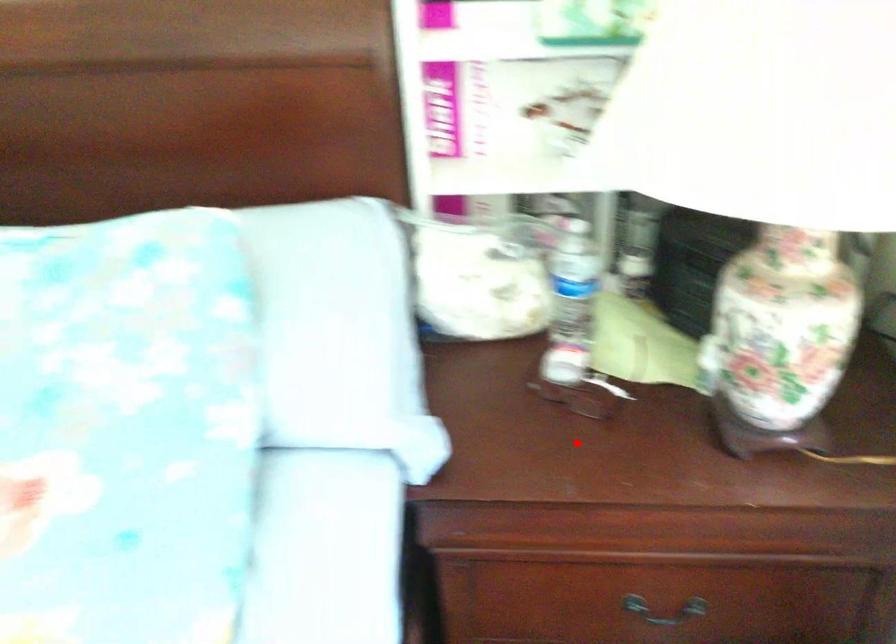
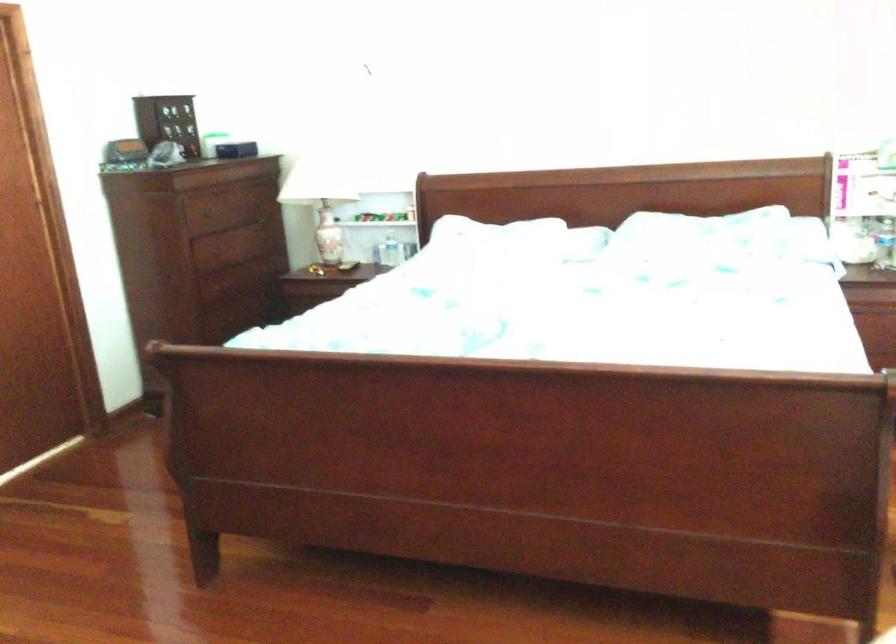
The point at the highlighted location is marked in the first image. Where is the corresponding point in the second image?

(883, 243)